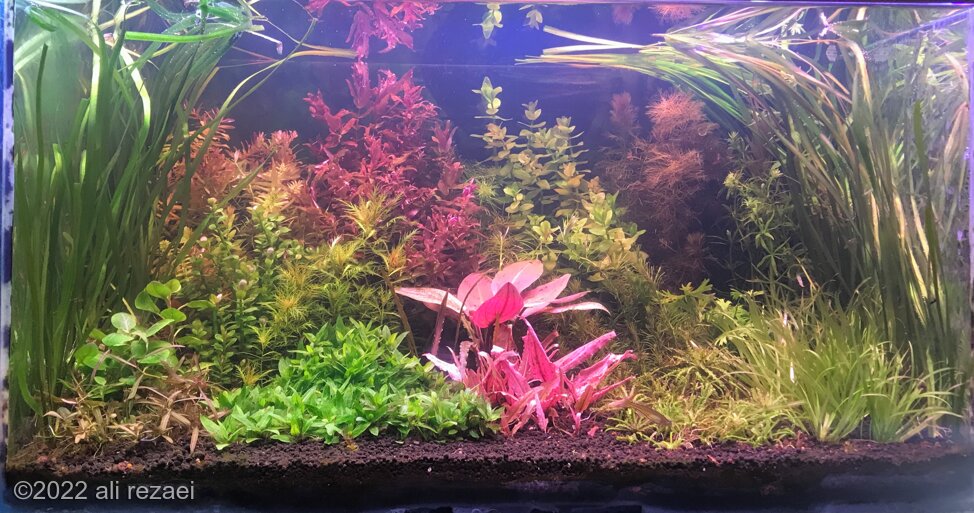
Where is `corner of aquarium`? This screenshot has height=513, width=974. corner of aquarium is located at coordinates (6, 503).